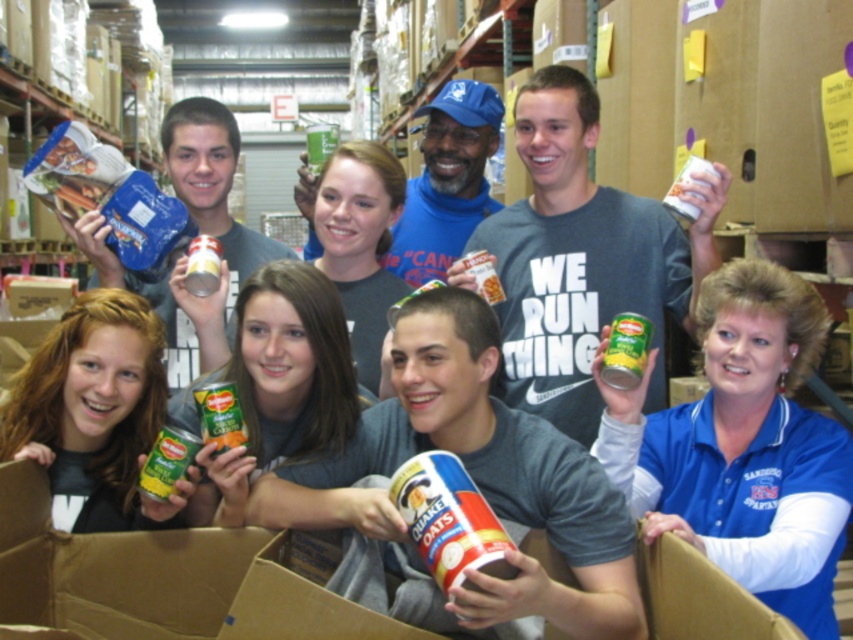
You are a volunteer at a food distribution event. You need to place the white paper cup at center and the green metallic can at center into a box. The box can only fit items that are wider than 10 cm. Can both items fit?

The white paper cup at center might be wider than green metallic can at center, but without knowing their exact widths, we cannot confirm if both are wider than 10 cm. Please measure them first.